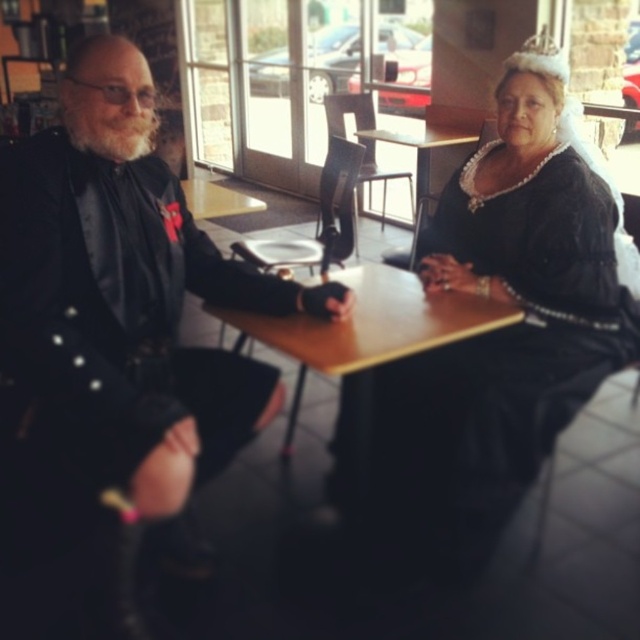
Question: Which is nearer to the black satin dress at center?

Choices:
 (A) wooden table at center
 (B) black satin suit at left

Answer: (A)

Question: Does black satin dress at center lie behind wooden table at center?

Choices:
 (A) yes
 (B) no

Answer: (A)

Question: Which point is farther from the camera taking this photo?

Choices:
 (A) (116, 579)
 (B) (262, 324)
 (C) (560, 51)

Answer: (C)

Question: Does black satin suit at left have a greater width compared to black satin dress at center?

Choices:
 (A) no
 (B) yes

Answer: (B)

Question: Observing the image, what is the correct spatial positioning of black satin suit at left in reference to black satin dress at center?

Choices:
 (A) left
 (B) right

Answer: (A)

Question: Which of the following is the farthest from the observer?

Choices:
 (A) (536, 413)
 (B) (138, 392)
 (C) (433, 310)

Answer: (A)